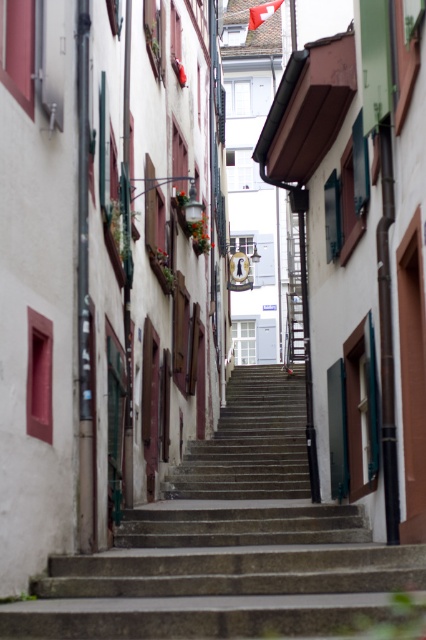
Can you confirm if concrete stairs at center is shorter than red fabric flag at upper center?

Yes.

Does concrete stairs at center have a smaller size compared to red fabric flag at upper center?

No.

Locate an element on the screen. The image size is (426, 640). concrete stairs at center is located at coordinates (227, 545).

Image resolution: width=426 pixels, height=640 pixels. I want to click on concrete stairs at center, so click(227, 545).